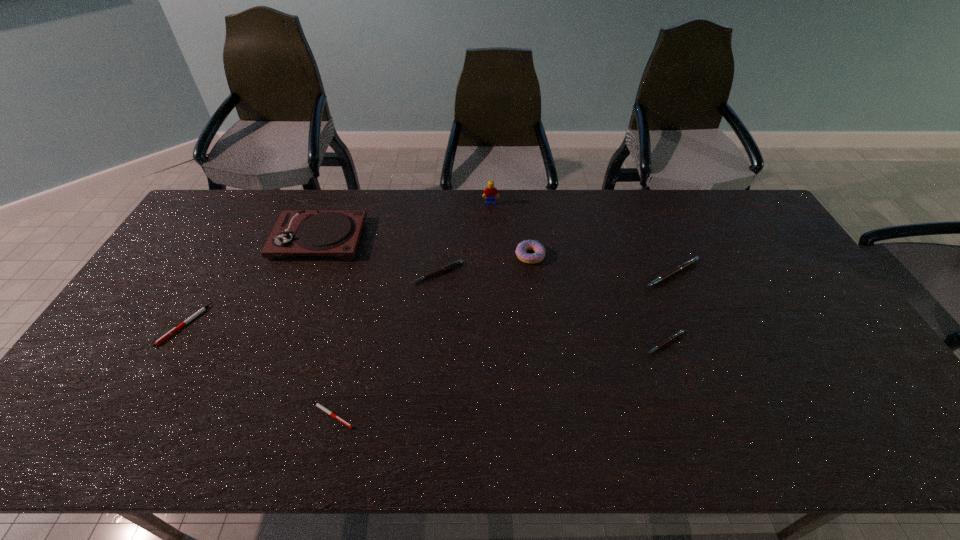
The image size is (960, 540). Identify the location of vacant area situated 0.150m on the clicker of the bigger white pen. (141, 400).

Where is `free space located 0.350m on the clicker of the nearer white pen`? free space located 0.350m on the clicker of the nearer white pen is located at coordinates (506, 415).

The image size is (960, 540). Find the location of `Lego at the far edge`. Lego at the far edge is located at coordinates (490, 192).

Identify the location of phonograph_record that is positioned at the far edge. (337, 233).

You are a GUI agent. You are given a task and a screenshot of the screen. Output one action in this format:
    pyautogui.click(x=<x>, y=<y>)
    Task: Click on the object that is positioned at the near edge
    This screenshot has height=540, width=960.
    Given the screenshot: What is the action you would take?
    pyautogui.click(x=318, y=405)

The width and height of the screenshot is (960, 540). Identify the location of object at the left edge. (168, 334).

At what (x,y) coordinates should I click in order to perform the action: click on free space at the far edge of the desktop. Please return your answer as a coordinate pair (x, y). This screenshot has height=540, width=960. Looking at the image, I should click on (331, 195).

Identify the location of free space at the near edge. (275, 450).

The height and width of the screenshot is (540, 960). I want to click on vacant space at the left edge of the desktop, so click(x=102, y=383).

Where is `vacant region at the right edge of the desktop`? This screenshot has height=540, width=960. vacant region at the right edge of the desktop is located at coordinates (785, 276).